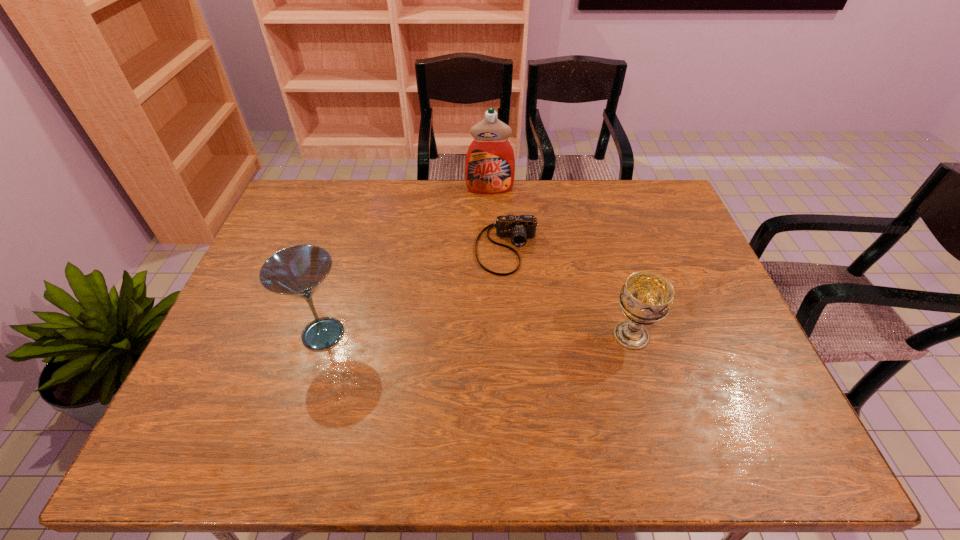
You are a GUI agent. You are given a task and a screenshot of the screen. Output one action in this format:
    pyautogui.click(x=<x>, y=<y>)
    Task: Click on the second tallest object
    
    Given the screenshot: What is the action you would take?
    pyautogui.click(x=298, y=271)

The height and width of the screenshot is (540, 960). Find the location of `the leftmost object`. the leftmost object is located at coordinates (298, 271).

Image resolution: width=960 pixels, height=540 pixels. I want to click on chalice, so click(x=645, y=298).

Identify the location of the third tallest object. The width and height of the screenshot is (960, 540). (645, 298).

Identify the location of detergent. (490, 163).

Locate an element on the screen. Image resolution: width=960 pixels, height=540 pixels. the farthest object is located at coordinates (490, 163).

At what (x,y) coordinates should I click in order to perform the action: click on the shortest object. Please return your answer as a coordinate pair (x, y). This screenshot has height=540, width=960. Looking at the image, I should click on (518, 228).

You are a GUI agent. You are given a task and a screenshot of the screen. Output one action in this format:
    pyautogui.click(x=<x>, y=<y>)
    Task: Click on the camera
    The image size is (960, 540).
    Given the screenshot: What is the action you would take?
    pyautogui.click(x=518, y=228)

This screenshot has height=540, width=960. In order to click on vacant space positioned on the front of the second tallest object in this screenshot , I will do `click(305, 393)`.

This screenshot has width=960, height=540. I want to click on blank space located on the left of the chalice, so click(x=577, y=335).